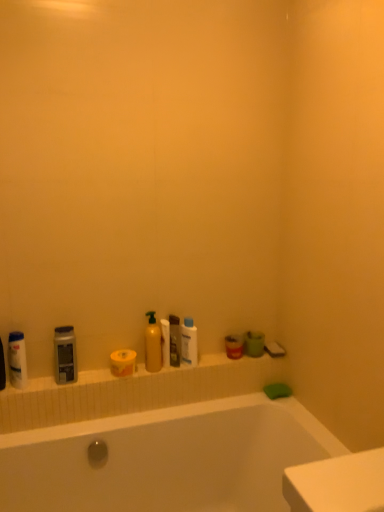
Locate an element on the screen. This screenshot has width=384, height=512. empty space that is in between matte gray bottle at left, which is counted as the first cleaning product, starting from the left, and yellow matte toilet paper at center, acting as the 1th toilet paper starting from the left is located at coordinates [92, 378].